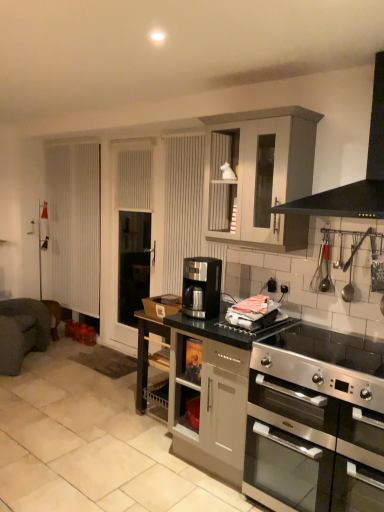
Question: From the image's perspective, does satin black coffee machine at center appear higher than black matte range hood at upper right?

Choices:
 (A) yes
 (B) no

Answer: (B)

Question: From a real-world perspective, is satin black coffee machine at center located beneath black matte range hood at upper right?

Choices:
 (A) yes
 (B) no

Answer: (A)

Question: Are satin black coffee machine at center and black matte range hood at upper right located far from each other?

Choices:
 (A) no
 (B) yes

Answer: (A)

Question: Can black matte range hood at upper right be found inside satin black coffee machine at center?

Choices:
 (A) no
 (B) yes

Answer: (A)

Question: From a real-world perspective, is satin black coffee machine at center on black matte range hood at upper right?

Choices:
 (A) no
 (B) yes

Answer: (A)

Question: From a real-world perspective, relative to stainless steel oven at lower right, is satin black coffee machine at center vertically above or below?

Choices:
 (A) above
 (B) below

Answer: (A)

Question: Is satin black coffee machine at center inside or outside of stainless steel oven at lower right?

Choices:
 (A) outside
 (B) inside

Answer: (A)

Question: Based on their sizes in the image, would you say satin black coffee machine at center is bigger or smaller than stainless steel oven at lower right?

Choices:
 (A) small
 (B) big

Answer: (A)

Question: Is satin black coffee machine at center to the left or to the right of stainless steel oven at lower right in the image?

Choices:
 (A) left
 (B) right

Answer: (A)

Question: In terms of size, does dark gray fabric armchair at left appear bigger or smaller than black matte range hood at upper right?

Choices:
 (A) small
 (B) big

Answer: (B)

Question: From a real-world perspective, is dark gray fabric armchair at left above or below black matte range hood at upper right?

Choices:
 (A) above
 (B) below

Answer: (B)

Question: Visually, is dark gray fabric armchair at left positioned to the left or to the right of black matte range hood at upper right?

Choices:
 (A) right
 (B) left

Answer: (B)

Question: In the image, is dark gray fabric armchair at left positioned in front of or behind black matte range hood at upper right?

Choices:
 (A) behind
 (B) front

Answer: (A)

Question: Based on their sizes in the image, would you say matte gray cabinet at center, which is counted as the 1th cabinetry, starting from the bottom, is bigger or smaller than stainless steel oven at lower right?

Choices:
 (A) big
 (B) small

Answer: (A)

Question: Is matte gray cabinet at center, which is counted as the 1th cabinetry, starting from the bottom, taller or shorter than stainless steel oven at lower right?

Choices:
 (A) tall
 (B) short

Answer: (A)